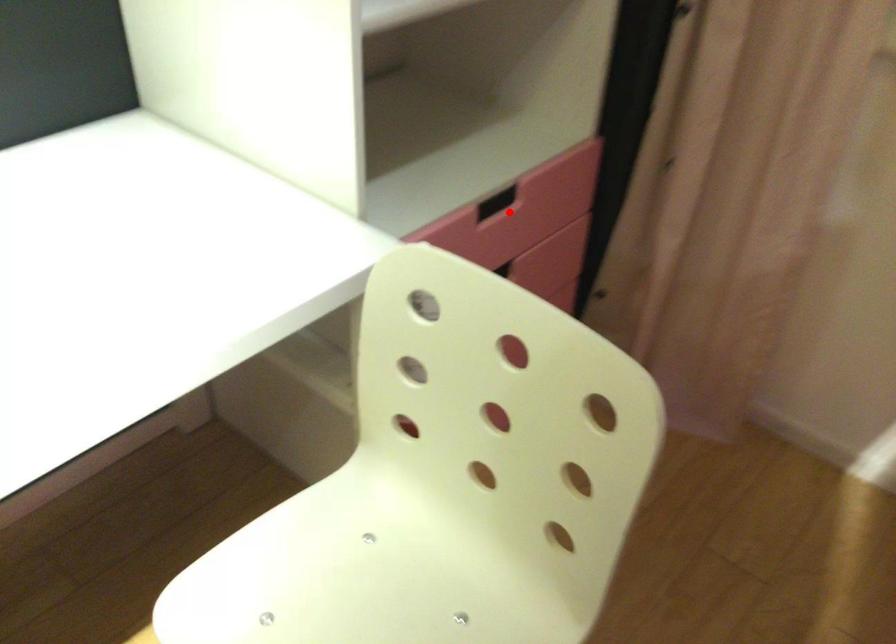
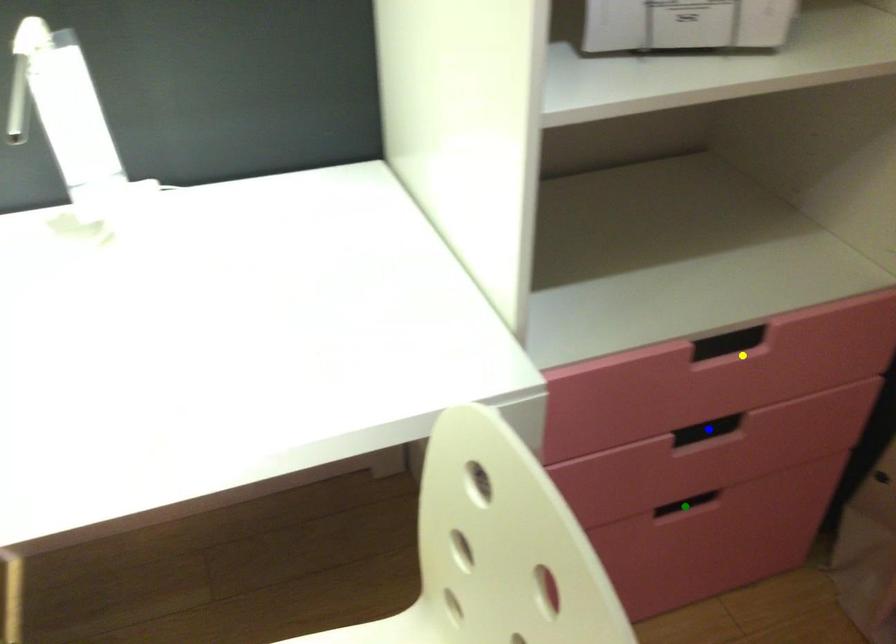
Question: I am providing you with two images of the same scene from different viewpoints. A red point is marked on the first image. You are given multiple points on the second image. Which spot in image 2 lines up with the point in image 1?

Choices:
 (A) blue point
 (B) yellow point
 (C) green point

Answer: (B)